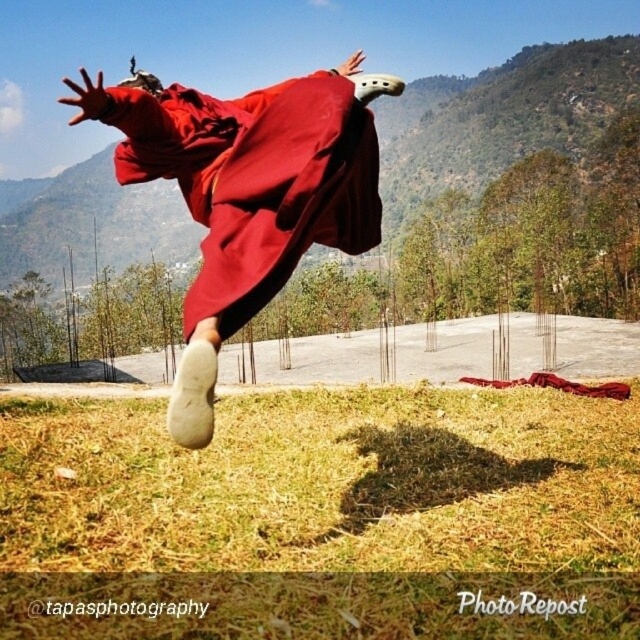
You are an observer standing on the concrete platform and see the dry grass at lower center and the matte red robe at center. Which object is taller?

The matte red robe at center is taller than the dry grass at lower center.

You are a photographer trying to capture the perfect shot of the scene. You need to ensure that the dry grass at lower center is visible beneath the matte red robe at center. Is this possible given their positions?

Yes, the dry grass at lower center is positioned under the matte red robe at center, so it should be visible beneath it in the photograph.